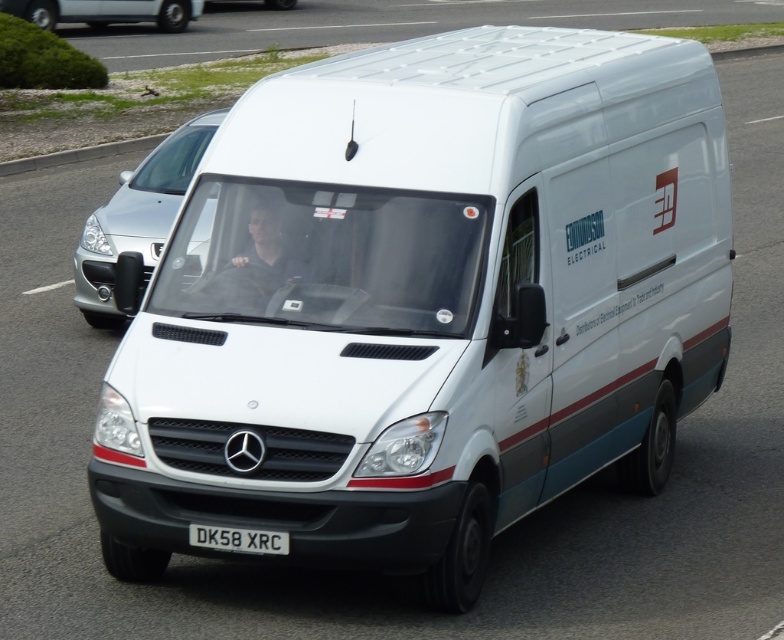
Is point (6, 10) positioned before point (227, 545)?

That is False.

Does silver metallic van at upper left have a lesser height compared to white plastic license plate at center?

No, silver metallic van at upper left is not shorter than white plastic license plate at center.

Who is more distant from viewer, (180, 4) or (224, 541)?

The point (180, 4) is more distant.

You are a GUI agent. You are given a task and a screenshot of the screen. Output one action in this format:
    pyautogui.click(x=<x>, y=<y>)
    Task: Click on the silver metallic van at upper left
    The width and height of the screenshot is (784, 640).
    Given the screenshot: What is the action you would take?
    pyautogui.click(x=104, y=12)

Between satin silver car at left and white plastic license plate at center, which one appears on the right side from the viewer's perspective?

Positioned to the right is white plastic license plate at center.

Who is more distant from viewer, (173, 193) or (229, 534)?

Point (173, 193)

Locate an element on the screen. The height and width of the screenshot is (640, 784). satin silver car at left is located at coordinates (136, 218).

Who is taller, satin silver car at left or silver metallic van at upper left?

Standing taller between the two is satin silver car at left.

Can you confirm if satin silver car at left is positioned above silver metallic van at upper left?

Actually, satin silver car at left is below silver metallic van at upper left.

Does point (115, 214) lie in front of point (180, 17)?

Yes, it is in front of point (180, 17).

Where is `satin silver car at left`? The height and width of the screenshot is (640, 784). satin silver car at left is located at coordinates (136, 218).